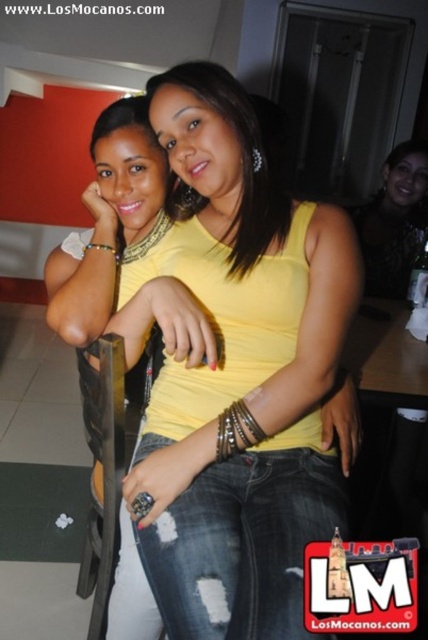
You are at a party and want to take a photo of both the yellow matte tank top at center and the matte black top at upper right. Since you can only focus on one at a time, which one should you focus on first if you want to capture them in the order they appear from left to right?

The yellow matte tank top at center is to the left of the matte black top at upper right, so you should focus on the yellow matte tank top at center first to capture them in left to right order.

You are a photographer standing at the camera position. You want to place a small decoration exactly 1 meter away from your current position. Can you place it at the point labeled as point (317, 538)?

The point (317, 538) is 86.09 centimeters away from the camera, which is less than 1 meter. Therefore, placing the decoration there would not meet the requirement of being exactly 1 meter away.

You are standing in a room and see two women posing closely together. There is a point at coordinates point (205, 339). If you want to touch this point with your hand, which woman are you more likely to have to reach towards?

The point point (205, 339) is 39.27 inches from the viewer, so you would need to reach towards the woman on the right since she is closer to the viewer than the woman on the left who is partially obscured.